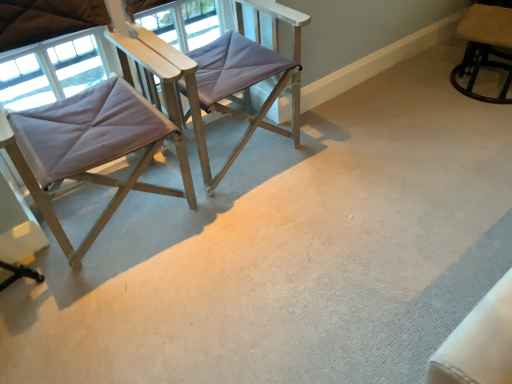
The image size is (512, 384). Identify the location of free space underneath matte purple fabric chair at center, marked as the second chair in a left-to-right arrangement (from a real-world perspective). (250, 169).